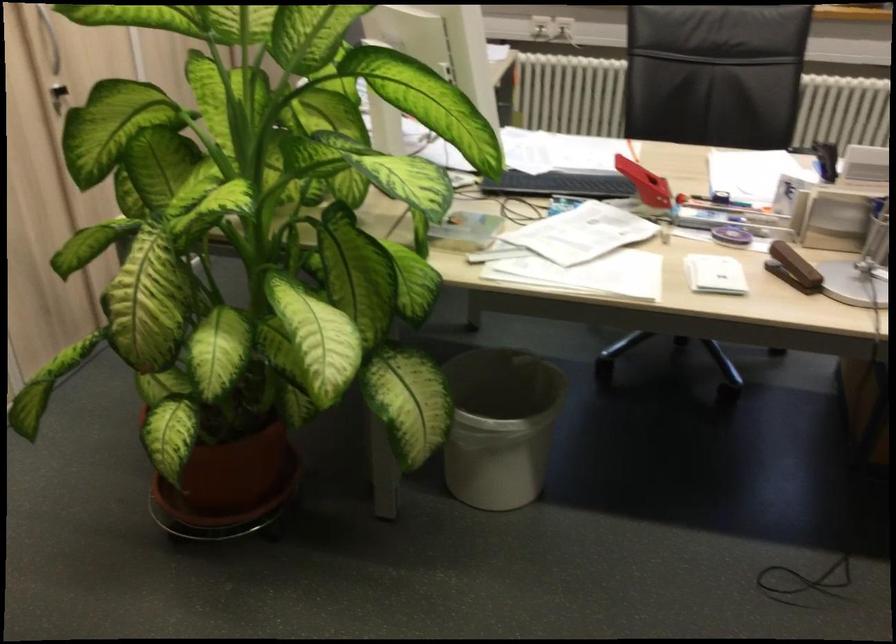
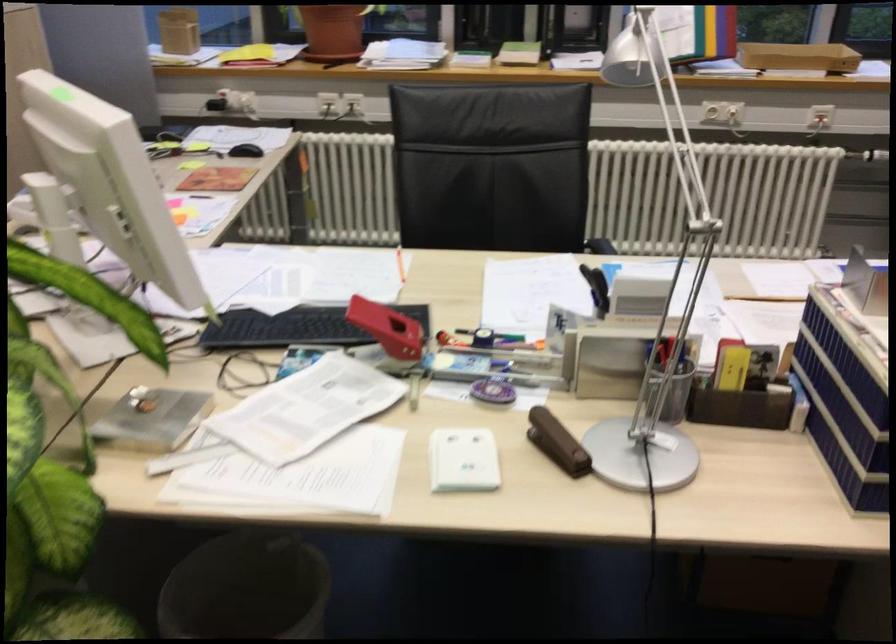
Where in the second image is the point corresponding to pixel 789 269 from the first image?

(556, 442)